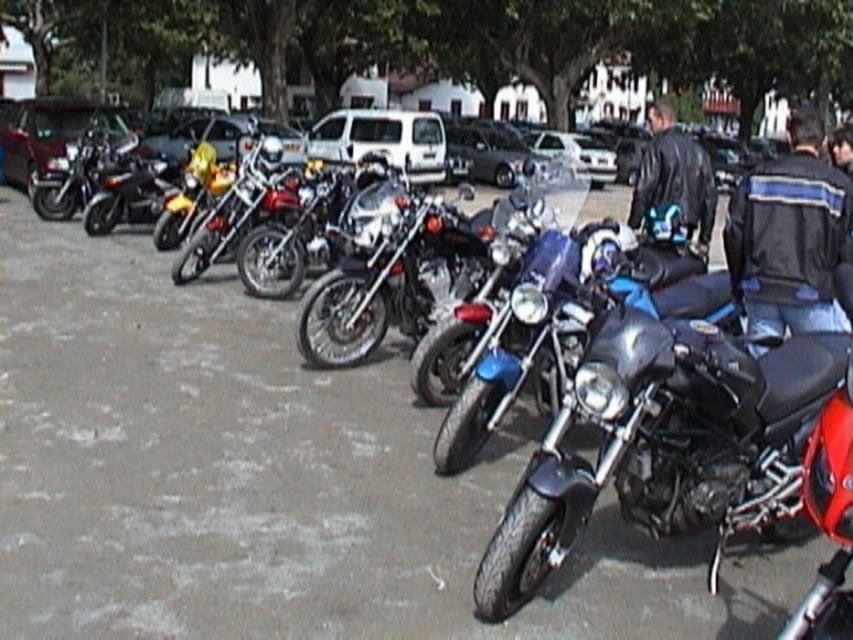
Consider the image. Between black leather jacket at center and leather jacket at center, which one has less height?

With less height is black leather jacket at center.

Can you confirm if black leather jacket at center is positioned to the left of leather jacket at center?

Indeed, black leather jacket at center is positioned on the left side of leather jacket at center.

Who is more distant from viewer, (795, 148) or (654, 106)?

Point (654, 106)

Identify the location of black leather jacket at center. Image resolution: width=853 pixels, height=640 pixels. (788, 236).

Is shiny chrome motorcycle at center smaller than metallic silver car at center?

Yes, shiny chrome motorcycle at center is smaller than metallic silver car at center.

Can you confirm if shiny chrome motorcycle at center is taller than metallic silver car at center?

Incorrect, shiny chrome motorcycle at center's height is not larger of metallic silver car at center's.

Locate an element on the screen. This screenshot has height=640, width=853. shiny chrome motorcycle at center is located at coordinates (390, 280).

Is black leather jacket at center positioned behind metallic silver car at center?

No, black leather jacket at center is closer to the viewer.

Is point (744, 208) less distant than point (538, 156)?

Yes, it is.

Which is behind, point (759, 317) or point (483, 157)?

Positioned behind is point (483, 157).

This screenshot has height=640, width=853. Find the location of `black leather jacket at center`. black leather jacket at center is located at coordinates (788, 236).